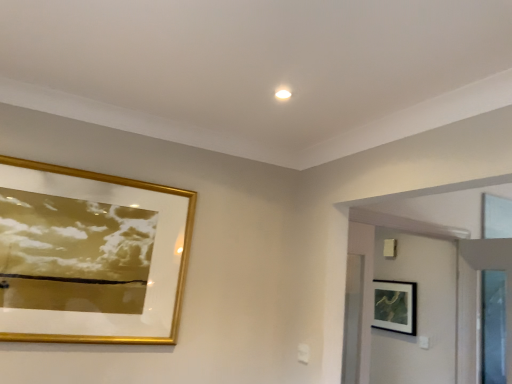
Question: From a real-world perspective, is white glossy door at upper right located beneath gold/glass picture frame at upper left, positioned as the first picture frame in left-to-right order?

Choices:
 (A) no
 (B) yes

Answer: (B)

Question: Is white glossy door at upper right completely or partially outside of gold/glass picture frame at upper left, which appears as the 1th picture frame when viewed from the top?

Choices:
 (A) no
 (B) yes

Answer: (B)

Question: Is white glossy door at upper right at the right side of gold/glass picture frame at upper left, acting as the 1th picture frame starting from the front?

Choices:
 (A) yes
 (B) no

Answer: (A)

Question: Is white glossy door at upper right far away from gold/glass picture frame at upper left, marked as the 2th picture frame in a back-to-front arrangement?

Choices:
 (A) yes
 (B) no

Answer: (A)

Question: From the image's perspective, does white glossy door at upper right appear higher than gold/glass picture frame at upper left, the second picture frame viewed from the right?

Choices:
 (A) no
 (B) yes

Answer: (A)

Question: Does white glossy door at upper right lie in front of gold/glass picture frame at upper left, acting as the 1th picture frame starting from the front?

Choices:
 (A) yes
 (B) no

Answer: (B)

Question: From the image's perspective, is gold/glass picture frame at upper left, acting as the 1th picture frame starting from the front, above white glossy door at upper right?

Choices:
 (A) no
 (B) yes

Answer: (B)

Question: Does gold/glass picture frame at upper left, which appears as the 1th picture frame when viewed from the top, have a lesser height compared to white glossy door at upper right?

Choices:
 (A) yes
 (B) no

Answer: (A)

Question: Is gold/glass picture frame at upper left, the second picture frame viewed from the right, facing away from white glossy door at upper right?

Choices:
 (A) yes
 (B) no

Answer: (B)

Question: Is white glossy door at upper right inside gold/glass picture frame at upper left, marked as the 2th picture frame in a back-to-front arrangement?

Choices:
 (A) yes
 (B) no

Answer: (B)

Question: From the image's perspective, does gold/glass picture frame at upper left, which appears as the 1th picture frame when viewed from the top, appear lower than white glossy door at upper right?

Choices:
 (A) yes
 (B) no

Answer: (B)

Question: From a real-world perspective, is gold/glass picture frame at upper left, acting as the 1th picture frame starting from the front, on white glossy door at upper right?

Choices:
 (A) yes
 (B) no

Answer: (A)

Question: Is black matte picture frame at upper right, the 2th picture frame in the top-to-bottom sequence, wider than gold/glass picture frame at upper left, which is counted as the 2th picture frame, starting from the bottom?

Choices:
 (A) no
 (B) yes

Answer: (B)